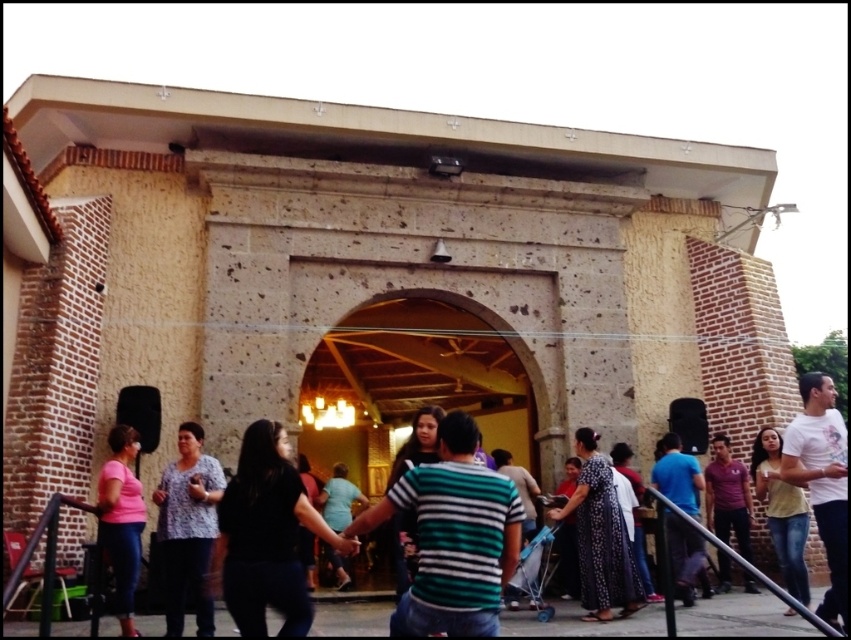
Based on the photo, is printed fabric dress at center positioned at the back of light blue shirt at center?

No.

Does printed fabric dress at center appear on the right side of light blue shirt at center?

Correct, you'll find printed fabric dress at center to the right of light blue shirt at center.

Is point (603, 538) positioned before point (341, 586)?

Yes, point (603, 538) is closer to viewer.

Where is `printed fabric dress at center`? The image size is (851, 640). printed fabric dress at center is located at coordinates (600, 536).

Between blue cotton shirt at right and light blue shirt at center, which one has less height?

With less height is light blue shirt at center.

Which is in front, point (671, 445) or point (334, 524)?

Point (671, 445) is in front.

At what (x,y) coordinates should I click in order to perform the action: click on blue cotton shirt at right. Please return your answer as a coordinate pair (x, y). This screenshot has height=640, width=851. Looking at the image, I should click on (677, 474).

Is the position of blue cotton shirt at right more distant than that of dark purple shirt at center?

No, blue cotton shirt at right is closer to the viewer.

Is point (677, 552) behind point (749, 515)?

No, it is in front of (749, 515).

At what (x,y) coordinates should I click in order to perform the action: click on blue cotton shirt at right. Please return your answer as a coordinate pair (x, y). The image size is (851, 640). Looking at the image, I should click on (677, 474).

At what (x,y) coordinates should I click in order to perform the action: click on blue cotton shirt at right. Please return your answer as a coordinate pair (x, y). The image size is (851, 640). Looking at the image, I should click on click(x=677, y=474).